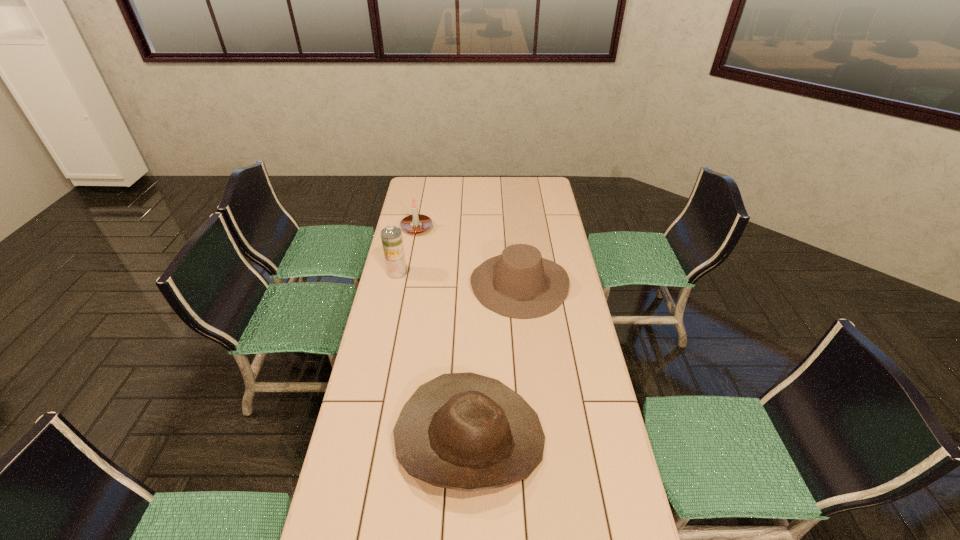
In order to click on cowboy hat located at the left edge in this screenshot , I will do `click(464, 431)`.

Identify the location of object situated at the right edge. (519, 283).

Identify the location of vacant space at the far edge. The image size is (960, 540). (467, 181).

Where is `vacant region at the left edge of the desktop`? This screenshot has width=960, height=540. vacant region at the left edge of the desktop is located at coordinates (366, 471).

In the image, there is a desktop. Identify the location of free space at the right edge. The height and width of the screenshot is (540, 960). (608, 415).

Where is `vacant area at the far left corner`? vacant area at the far left corner is located at coordinates (419, 193).

Image resolution: width=960 pixels, height=540 pixels. Identify the location of vacant space at the far right corner of the desktop. (546, 193).

Find the location of a particular element. The image size is (960, 540). free space between the farther cowboy hat and the farthest object is located at coordinates (468, 255).

In order to click on blank region between the tallest object and the nearest object in this screenshot , I will do point(434,355).

The width and height of the screenshot is (960, 540). In order to click on free spot between the nearer cowboy hat and the farther cowboy hat in this screenshot , I will do `click(494, 361)`.